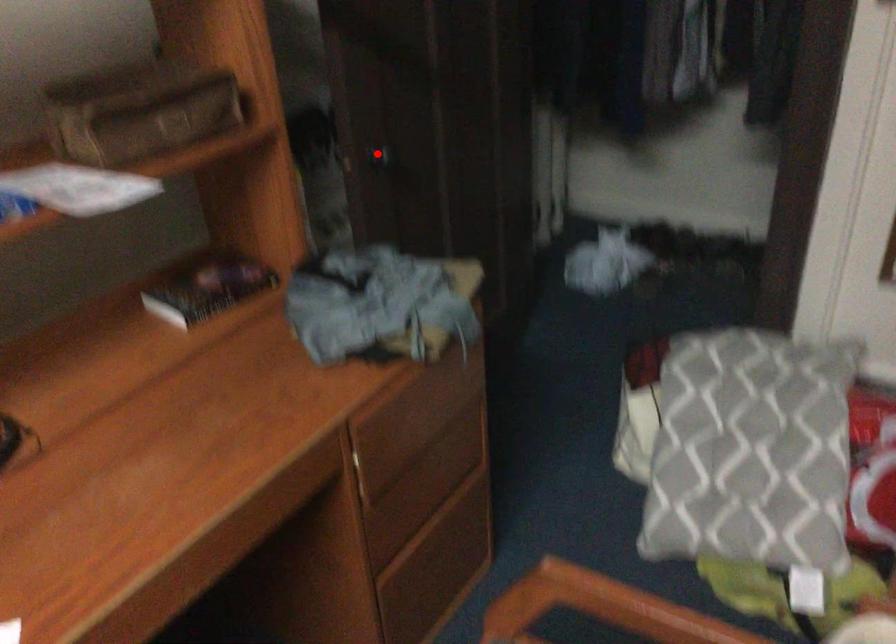
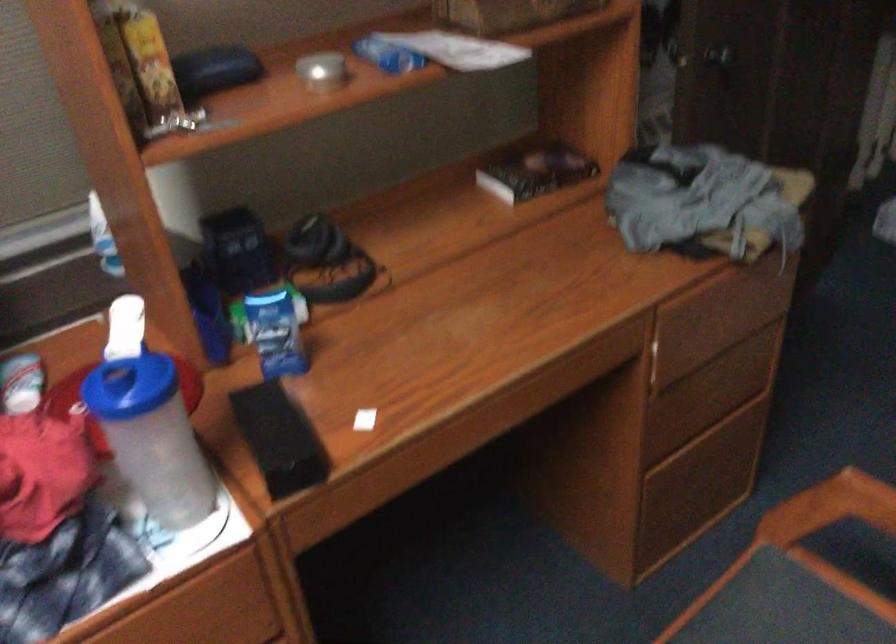
Find the pixel in the second image that matches the highlighted location in the first image.

(718, 55)